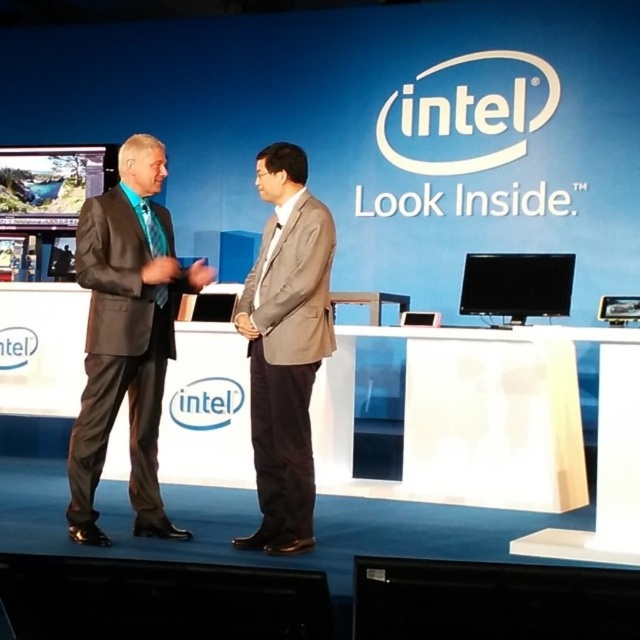
Who is shorter, matte black suit at left or light brown fabric suit at center?

Standing shorter between the two is matte black suit at left.

Does matte black suit at left have a lesser height compared to light brown fabric suit at center?

Yes.

Does point (97, 371) come closer to viewer compared to point (273, 349)?

No, (97, 371) is further to viewer.

In order to click on matte black suit at left in this screenshot , I will do `click(120, 355)`.